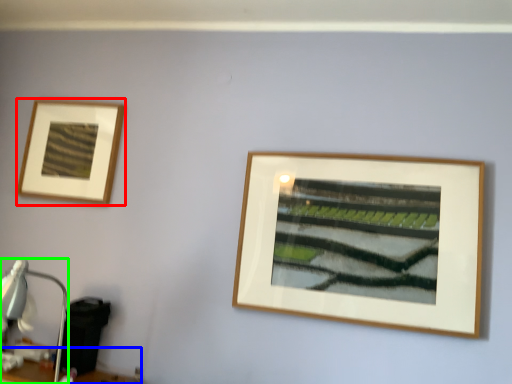
Question: Considering the real-world distances, which object is closest to picture frame (highlighted by a red box)? table (highlighted by a blue box) or table lamp (highlighted by a green box).

Choices:
 (A) table
 (B) table lamp

Answer: (B)